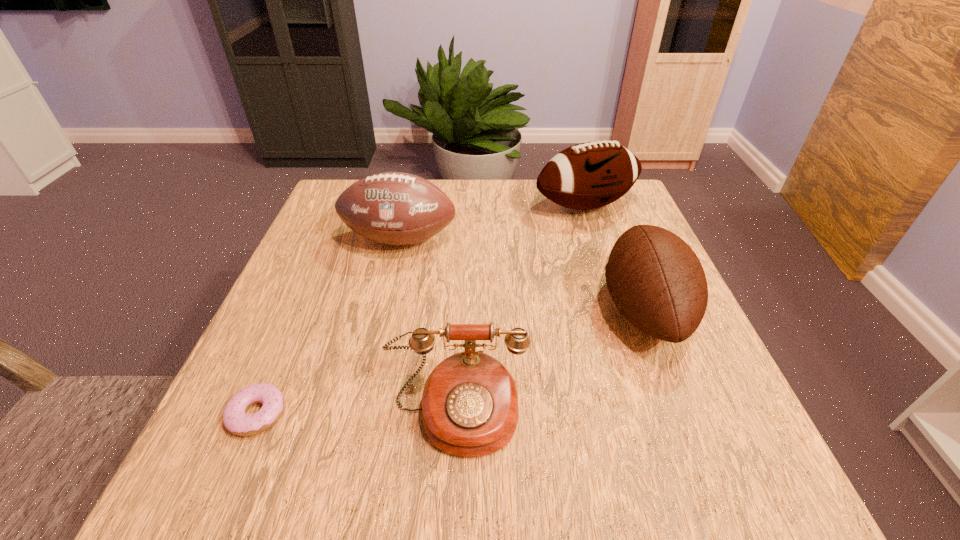
Locate an element on the screen. This screenshot has height=540, width=960. object at the near edge is located at coordinates (470, 408).

Image resolution: width=960 pixels, height=540 pixels. Find the location of `football (American) that is at the left edge`. football (American) that is at the left edge is located at coordinates (394, 208).

Identify the location of doughnut located at the left edge. (235, 419).

The image size is (960, 540). Find the location of `object that is positioned at the far left corner`. object that is positioned at the far left corner is located at coordinates (394, 208).

Where is `object at the far right corner`? object at the far right corner is located at coordinates (590, 175).

Image resolution: width=960 pixels, height=540 pixels. In the image, there is a desktop. What are the coordinates of `free space at the far edge` in the screenshot? It's located at (495, 185).

At what (x,y) coordinates should I click in order to perform the action: click on blank space at the near edge. Please return your answer as a coordinate pair (x, y). This screenshot has width=960, height=540. Looking at the image, I should click on (542, 459).

This screenshot has width=960, height=540. Identify the location of free spot at the left edge of the desktop. point(293,306).

Find the location of `free region at the right edge of the desktop`. free region at the right edge of the desktop is located at coordinates (671, 422).

In the image, there is a desktop. Identify the location of blank space at the near left corner. (252, 475).